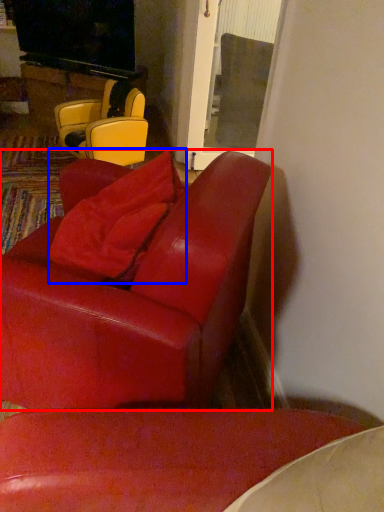
Question: Which object appears closest to the camera in this image, chair (highlighted by a red box) or pillow (highlighted by a blue box)?

Choices:
 (A) chair
 (B) pillow

Answer: (A)